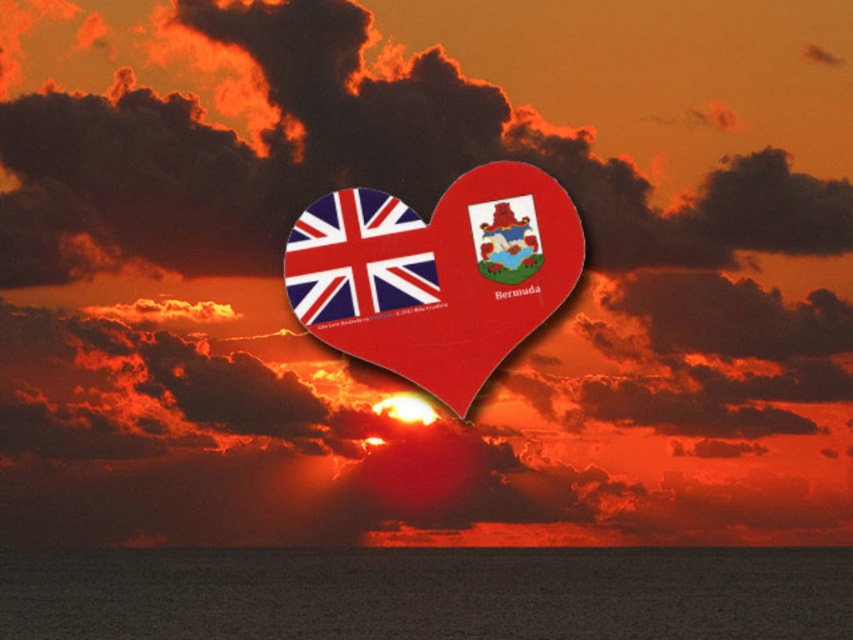
Question: Which of the following is the farthest from the observer?

Choices:
 (A) (294, 275)
 (B) (45, 630)

Answer: (B)

Question: Does smooth water at bottom have a smaller size compared to matte plastic heart at center?

Choices:
 (A) no
 (B) yes

Answer: (A)

Question: Which object appears farthest from the camera in this image?

Choices:
 (A) matte fabric flag at center
 (B) smooth water at bottom
 (C) matte plastic heart at center

Answer: (B)

Question: Estimate the real-world distances between objects in this image. Which object is farther from the smooth water at bottom?

Choices:
 (A) matte fabric flag at center
 (B) matte plastic heart at center

Answer: (A)

Question: Is the position of smooth water at bottom more distant than that of matte fabric flag at center?

Choices:
 (A) no
 (B) yes

Answer: (B)

Question: Does smooth water at bottom come behind matte plastic heart at center?

Choices:
 (A) no
 (B) yes

Answer: (B)